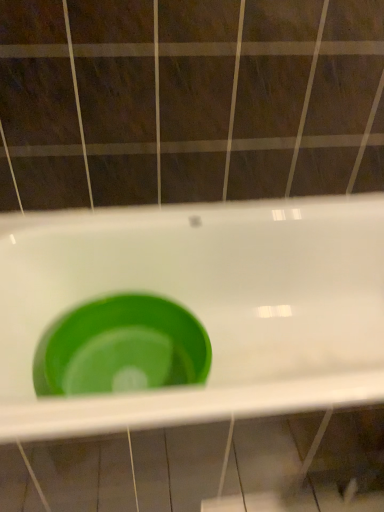
Question: From the image's perspective, relative to green plastic sink at center, is green plastic basin at center above or below?

Choices:
 (A) below
 (B) above

Answer: (B)

Question: Is point (107, 297) positioned closer to the camera than point (379, 335)?

Choices:
 (A) closer
 (B) farther

Answer: (A)

Question: Which is correct: green plastic basin at center is inside green plastic sink at center, or outside of it?

Choices:
 (A) inside
 (B) outside

Answer: (A)

Question: Visually, is green plastic sink at center positioned to the left or to the right of green plastic basin at center?

Choices:
 (A) left
 (B) right

Answer: (B)

Question: Which is correct: green plastic sink at center is inside green plastic basin at center, or outside of it?

Choices:
 (A) inside
 (B) outside

Answer: (B)

Question: From a real-world perspective, is green plastic sink at center physically located above or below green plastic basin at center?

Choices:
 (A) below
 (B) above

Answer: (B)

Question: Is green plastic sink at center taller or shorter than green plastic basin at center?

Choices:
 (A) tall
 (B) short

Answer: (A)